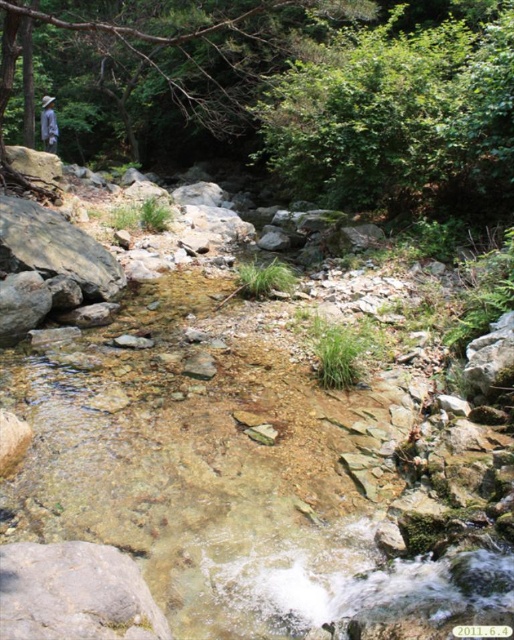
Which is behind, point (42, 436) or point (45, 108)?

The point (45, 108) is more distant.

Which is in front, point (498, 468) or point (42, 124)?

Point (498, 468) is more forward.

Where is `clear rock water at center`? clear rock water at center is located at coordinates (245, 484).